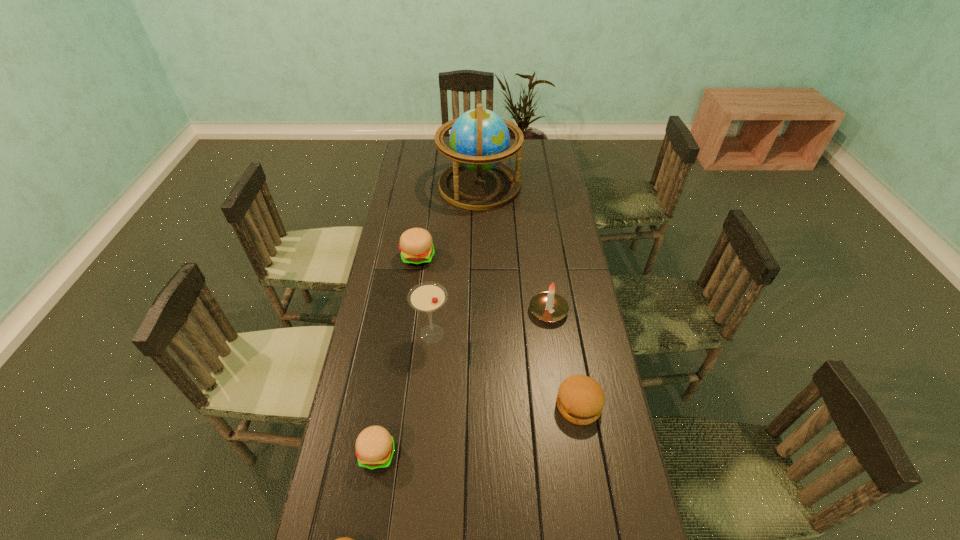
You are a GUI agent. You are given a task and a screenshot of the screen. Output one action in this format:
    pyautogui.click(x=<x>, y=<y>)
    Task: Click on the globe
    The width and height of the screenshot is (960, 540).
    Given the screenshot: What is the action you would take?
    pyautogui.click(x=479, y=139)

Identify the location of the tallest object. The width and height of the screenshot is (960, 540). (479, 139).

The image size is (960, 540). Find the location of `the second tallest object`. the second tallest object is located at coordinates (427, 297).

Identify the location of candle. (549, 306).

Where is `white candle`? white candle is located at coordinates [549, 306].

Identify the location of the fourth tallest object. (417, 249).

Find the location of a particular element. The image size is (960, 540). the tallest hamburger is located at coordinates (417, 249).

Locate an element on the screen. The image size is (960, 540). the second farthest hamburger is located at coordinates (580, 400).

Identify the location of the rightmost hamburger. This screenshot has width=960, height=540. (580, 400).

Image resolution: width=960 pixels, height=540 pixels. In order to click on the third farthest hamburger in this screenshot , I will do `click(375, 447)`.